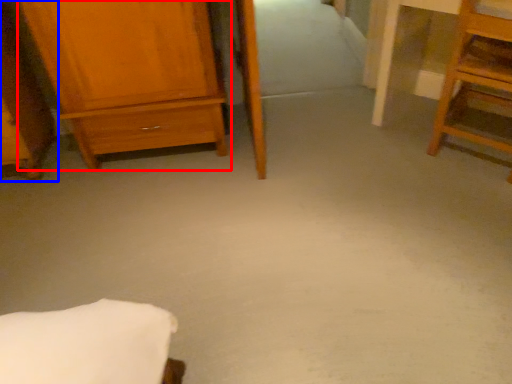
Question: Which object is closer to the camera taking this photo, chest of drawers (highlighted by a red box) or furniture (highlighted by a blue box)?

Choices:
 (A) chest of drawers
 (B) furniture

Answer: (B)